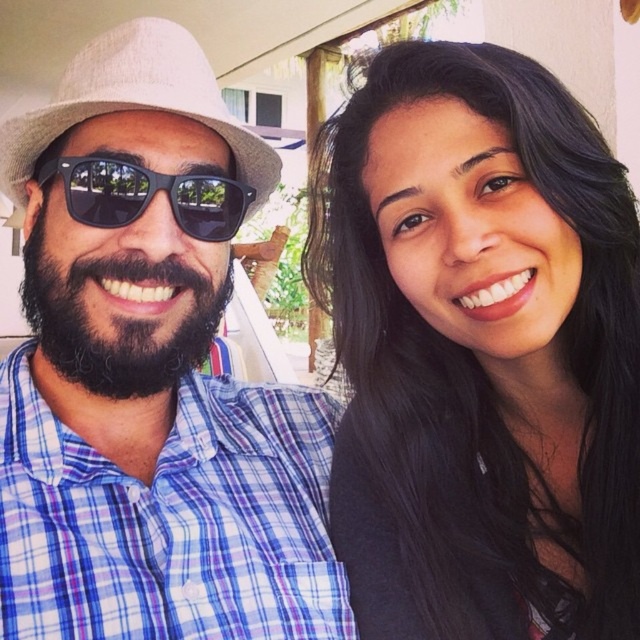
Is beige straw fedora at left closer to the viewer compared to black matte sunglasses at left?

Yes, beige straw fedora at left is in front of black matte sunglasses at left.

Which is above, beige straw fedora at left or black matte sunglasses at left?

beige straw fedora at left is above.

Is point (216, 92) less distant than point (90, 186)?

No, it is not.

The width and height of the screenshot is (640, 640). Find the location of `beige straw fedora at left`. beige straw fedora at left is located at coordinates (134, 102).

Who is more forward, (340, 310) or (76, 156)?

Point (76, 156) is in front.

You are a GUI agent. You are given a task and a screenshot of the screen. Output one action in this format:
    pyautogui.click(x=<x>, y=<y>)
    Task: Click on the black hair at upper right
    Image resolution: width=640 pixels, height=640 pixels.
    Given the screenshot: What is the action you would take?
    pyautogui.click(x=480, y=349)

Locate an element on the screen. The height and width of the screenshot is (640, 640). black hair at upper right is located at coordinates (480, 349).

Which is in front, point (138, 372) or point (116, 339)?

Point (116, 339) is more forward.

The image size is (640, 640). What do you see at coordinates (148, 374) in the screenshot? I see `plaid cotton shirt at left` at bounding box center [148, 374].

Find the location of a particular element. The image size is (640, 640). plaid cotton shirt at left is located at coordinates (148, 374).